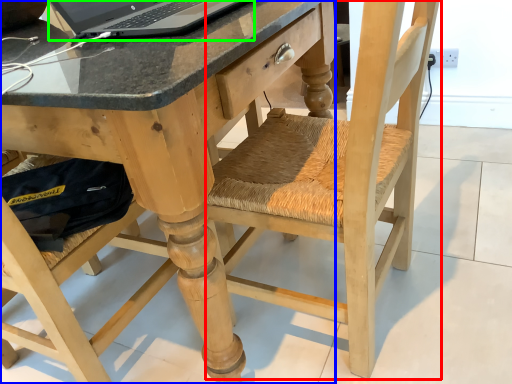
Question: Based on their relative distances, which object is nearer to swivel chair (highlighted by a red box)? Choose from desk (highlighted by a blue box) and laptop (highlighted by a green box).

Choices:
 (A) desk
 (B) laptop

Answer: (A)